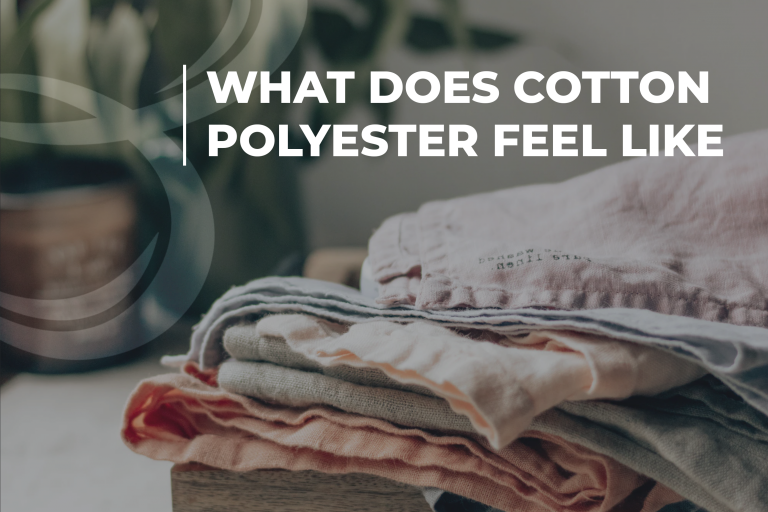
Locate an element on the screen. This screenshot has width=768, height=512. basket is located at coordinates (306, 490).